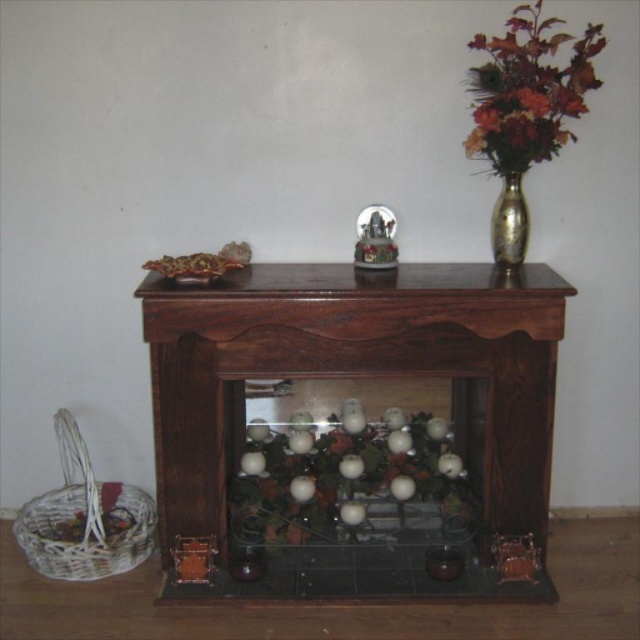
Can you confirm if white matte floral arrangement at center is smaller than multicolored silk bouquet at upper right?

No.

Is point (460, 483) positioned before point (540, 134)?

No, (460, 483) is further to viewer.

Describe the element at coordinates (340, 474) in the screenshot. I see `white matte floral arrangement at center` at that location.

Locate an element on the screen. This screenshot has height=640, width=640. white matte floral arrangement at center is located at coordinates (340, 474).

Who is higher up, dark wood fireplace at center or gold metallic vase at upper right?

gold metallic vase at upper right

Between dark wood fireplace at center and gold metallic vase at upper right, which one has more height?

Standing taller between the two is dark wood fireplace at center.

Between point (150, 291) and point (516, 241), which one is positioned behind?

The point (516, 241) is behind.

The width and height of the screenshot is (640, 640). Identify the location of dark wood fireplace at center. (355, 378).

Is white matte floral arrangement at center shorter than gold metallic vase at upper right?

Incorrect, white matte floral arrangement at center's height does not fall short of gold metallic vase at upper right's.

Can you confirm if white matte floral arrangement at center is wider than gold metallic vase at upper right?

Yes, white matte floral arrangement at center is wider than gold metallic vase at upper right.

This screenshot has height=640, width=640. Identify the location of white matte floral arrangement at center. (340, 474).

In order to click on white matte floral arrangement at center in this screenshot , I will do `click(340, 474)`.